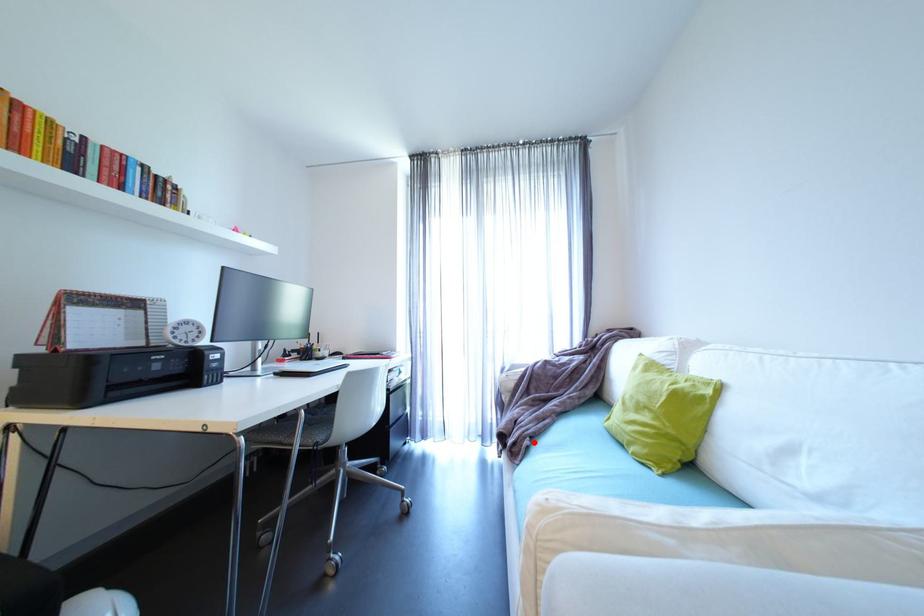
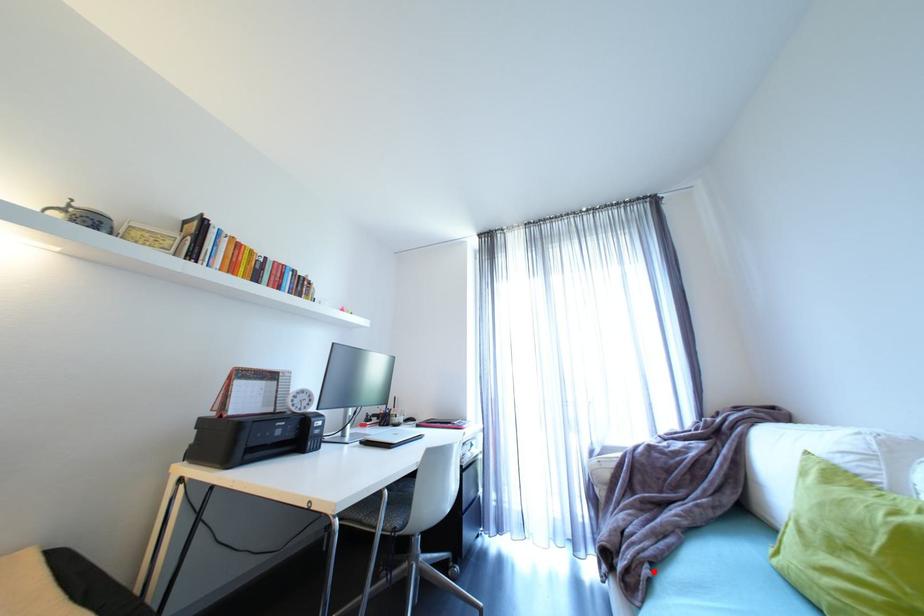
I am providing you with two images of the same scene from different viewpoints. A red point is marked on the first image and another point is marked on the second image. Are the points marked in image1 and image2 representing the same 3D position?

Yes